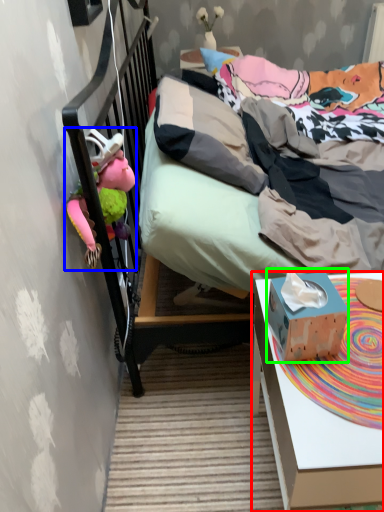
Question: Considering the real-world distances, which object is closest to desk (highlighted by a red box)? toy (highlighted by a blue box) or box (highlighted by a green box).

Choices:
 (A) toy
 (B) box

Answer: (B)